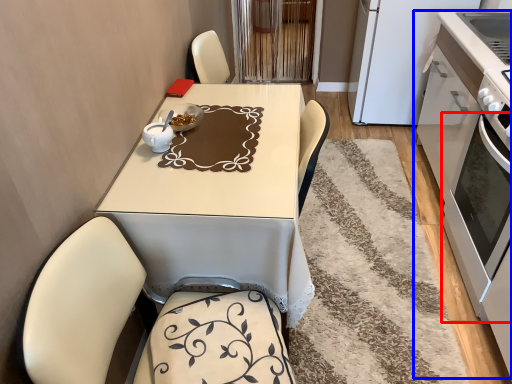
Question: Which object is further to the camera taking this photo, oven (highlighted by a red box) or cabinetry (highlighted by a blue box)?

Choices:
 (A) oven
 (B) cabinetry

Answer: (B)